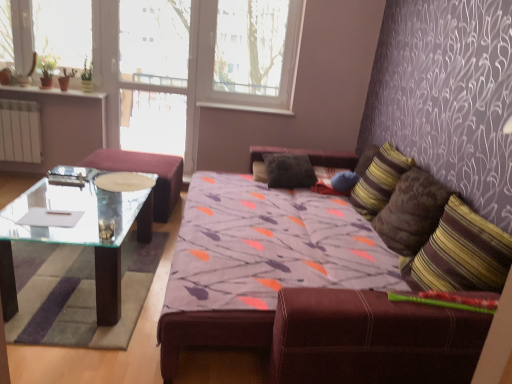
Locate an element on the screen. This screenshot has height=384, width=512. blank area beneath white paper at left (from a real-world perspective) is located at coordinates (52, 285).